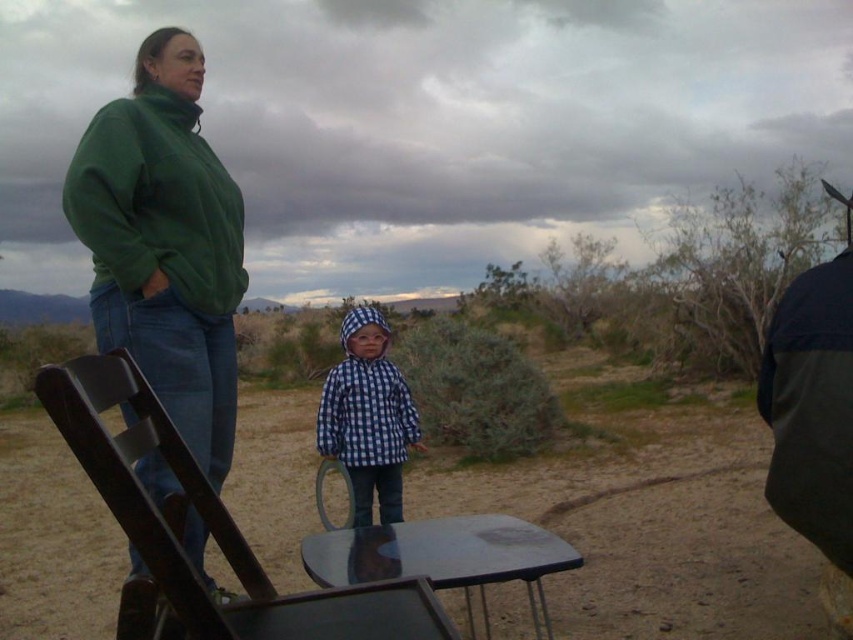
Question: Which point appears closest to the camera in this image?

Choices:
 (A) click(387, 468)
 (B) click(206, 156)
 (C) click(115, 330)
 (D) click(807, 356)

Answer: (D)

Question: Is dark green jacket at right thinner than blue checkered jacket at center?

Choices:
 (A) yes
 (B) no

Answer: (A)

Question: Which point is closer to the camera?

Choices:
 (A) (233, 186)
 (B) (387, 458)
 (C) (564, 522)

Answer: (A)

Question: Is green fleece jacket at upper left bigger than blue checkered jacket at center?

Choices:
 (A) yes
 (B) no

Answer: (B)

Question: Can you confirm if dirt field at center is wider than dark green jacket at right?

Choices:
 (A) yes
 (B) no

Answer: (A)

Question: Estimate the real-world distances between objects in this image. Which object is closer to the wooden folding chair at center?

Choices:
 (A) blue checkered jacket at center
 (B) dark green jacket at right
 (C) green fleece sweatshirt at upper left
 (D) green fleece jacket at upper left

Answer: (D)